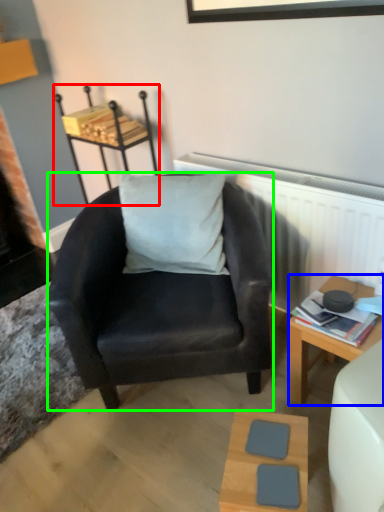
Question: Which is nearer to the stool (highlighted by a red box)? desk (highlighted by a blue box) or chair (highlighted by a green box).

Choices:
 (A) desk
 (B) chair

Answer: (B)